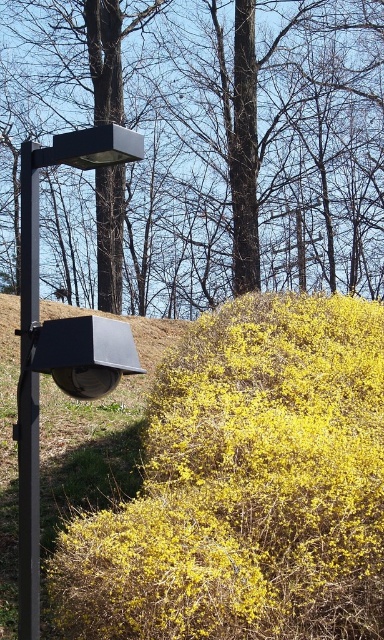
You are a pedestrian standing on the sidewalk and see the brown wood tree at upper center and the metallic black street sign at left. Which object is closer to your right side?

The metallic black street sign at left is closer to your right side because the brown wood tree at upper center is to the left of it.

You are an urban planner assessing the spacing between the brown wood tree at upper center and the black metal pole at left. Based on their widths, which object would require more horizontal space in the landscape design?

The brown wood tree at upper center would require more horizontal space in the landscape design since its width surpasses that of the black metal pole at left.

You are driving a car and see the brown wood tree at upper center and the metallic black street sign at left. Which object is closer to you?

The brown wood tree at upper center is closer to you because the metallic black street sign at left is behind it.